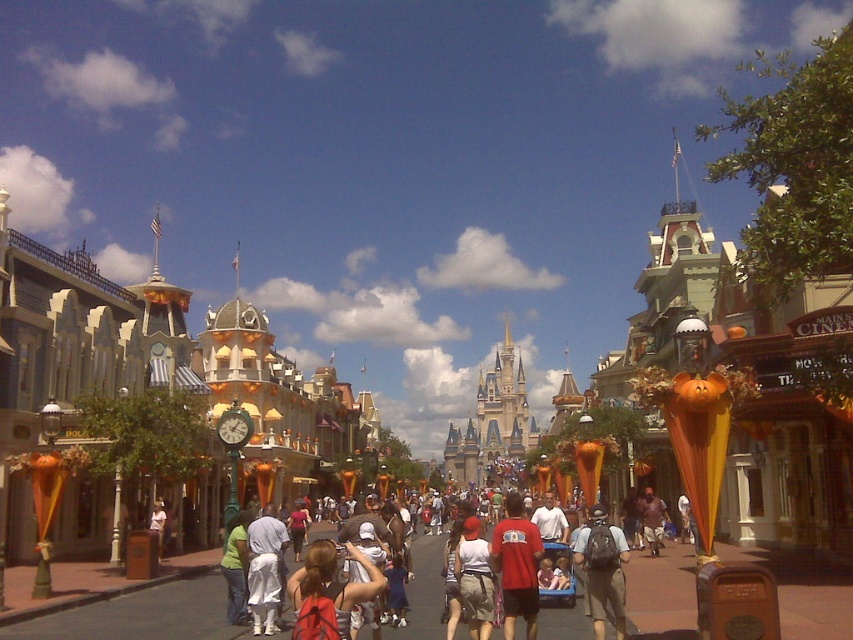
You are a photographer standing on the theme park street. You see the red shirt at center and the gray fabric backpack at center. Which object is closer to you?

The red shirt at center is closer to you because the gray fabric backpack at center is behind it.